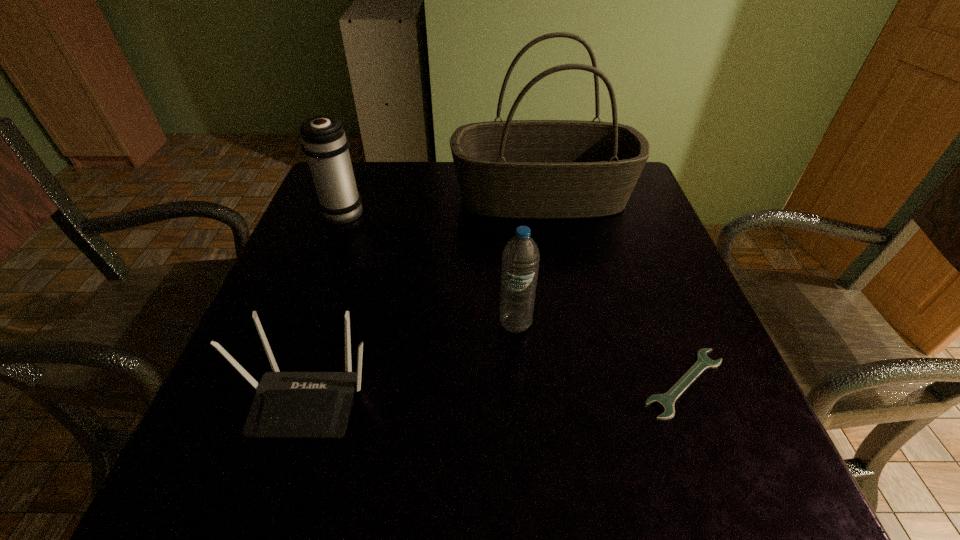
I want to click on the tallest object, so click(x=526, y=169).

This screenshot has height=540, width=960. Find the location of `thermos bottle`. thermos bottle is located at coordinates (324, 142).

This screenshot has width=960, height=540. Find the location of `the third farthest object`. the third farthest object is located at coordinates (520, 259).

In order to click on the second shortest object in this screenshot , I will do point(286,404).

At what (x,y) coordinates should I click in order to perform the action: click on the shortest object. Please return your answer as a coordinate pair (x, y). Looking at the image, I should click on (665, 401).

At what (x,y) coordinates should I click in order to perform the action: click on vacant region located 0.140m on the front of the tallest object. Please return your answer as a coordinate pair (x, y). This screenshot has width=960, height=540. Looking at the image, I should click on (555, 263).

Find the location of a particular element. This screenshot has width=960, height=540. vacant space located 0.140m on the side with the handle of the thermos bottle is located at coordinates (360, 168).

Locate an element on the screen. The image size is (960, 540). free space located 0.130m on the side with the handle of the thermos bottle is located at coordinates (359, 170).

Identify the location of vacant position located 0.180m on the side with the handle of the thermos bottle. The width and height of the screenshot is (960, 540). (363, 160).

Where is `free point located on the left of the water bottle`? free point located on the left of the water bottle is located at coordinates (x=351, y=323).